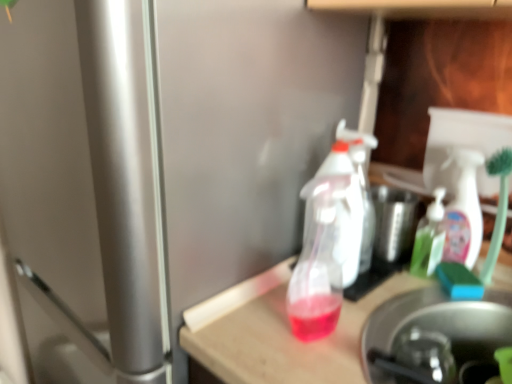
Where is `blank space to the left of green translucent soap dispenser at center, positioned as the second bottle in front-to-back order`? blank space to the left of green translucent soap dispenser at center, positioned as the second bottle in front-to-back order is located at coordinates (379, 279).